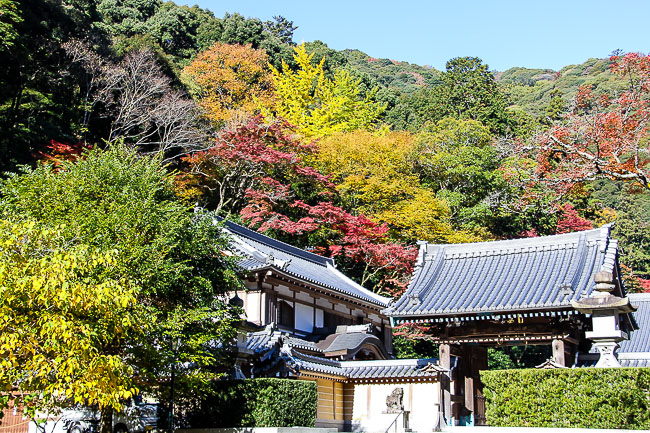
Image resolution: width=650 pixels, height=433 pixels. I want to click on columns, so click(595, 335), click(439, 352), click(561, 355).